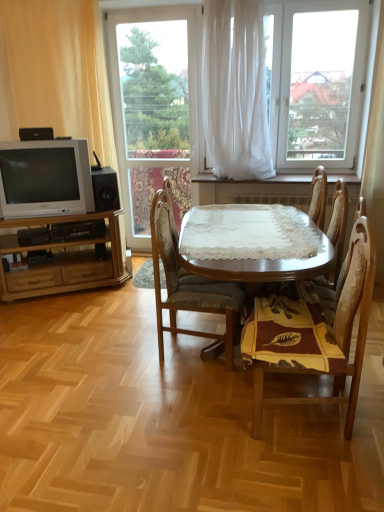
Locate an element on the screen. vacant space in front of wooden chair at center, arranged as the 2th chair when viewed from the left is located at coordinates (297, 475).